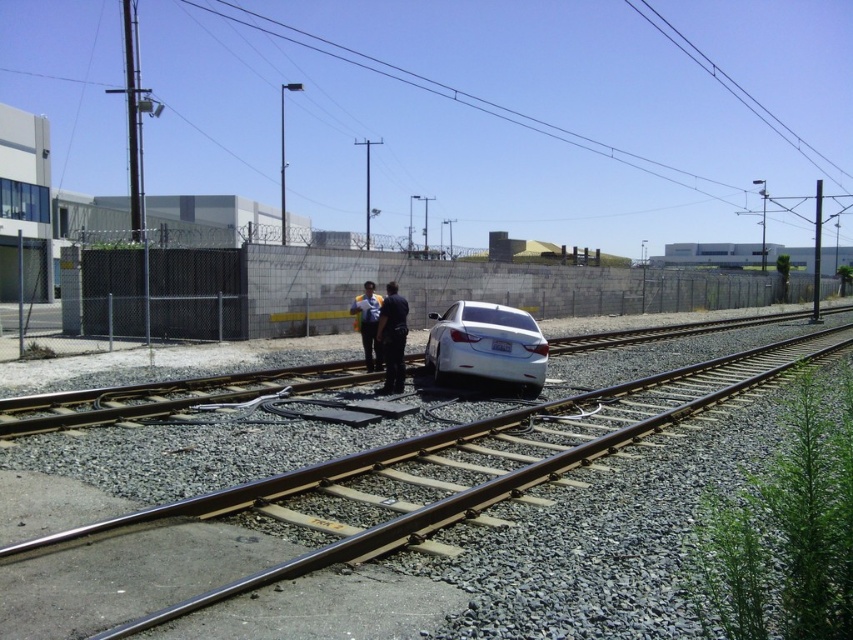
What do you see at coordinates (486, 346) in the screenshot?
I see `satin silver sedan at center` at bounding box center [486, 346].

From the picture: Is satin silver sedan at center bigger than blue shirt at center?

Yes.

Which is behind, point (483, 372) or point (367, 294)?

Positioned behind is point (367, 294).

Where is `satin silver sedan at center`? The width and height of the screenshot is (853, 640). satin silver sedan at center is located at coordinates (486, 346).

Based on the photo, which of these two, dark blue uniform at center or blue shirt at center, stands shorter?

dark blue uniform at center

Is dark blue uniform at center positioned in front of blue shirt at center?

Yes.

Does point (399, 308) lie behind point (374, 337)?

No, it is in front of (374, 337).

Find the location of `dark blue uniform at center`. dark blue uniform at center is located at coordinates (392, 339).

Between point (490, 333) and point (372, 305), which one is positioned in front?

Point (490, 333) is more forward.

This screenshot has height=640, width=853. Describe the element at coordinates (486, 346) in the screenshot. I see `satin silver sedan at center` at that location.

Locate an element on the screen. This screenshot has width=853, height=640. satin silver sedan at center is located at coordinates (486, 346).